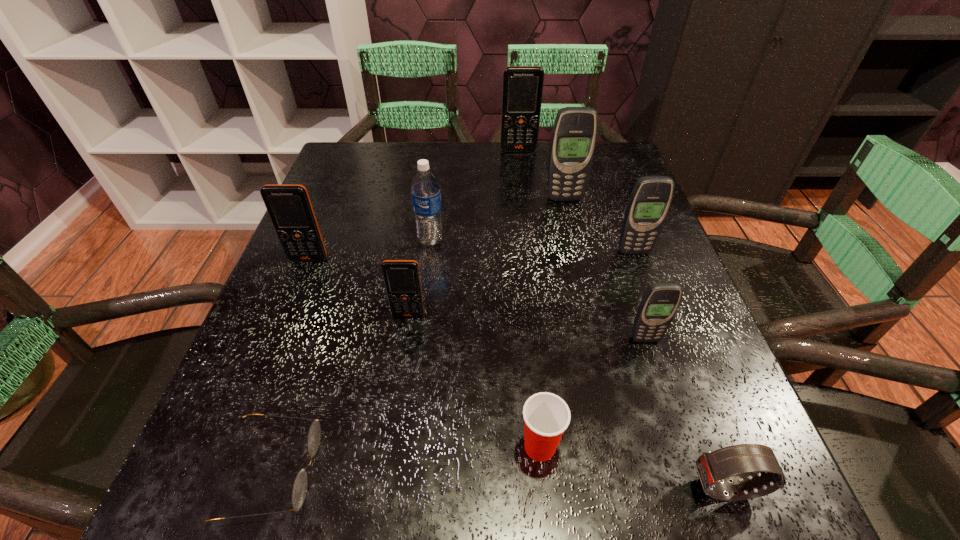
The width and height of the screenshot is (960, 540). Find the location of `free space located 0.080m on the screen of the second smallest gray cellular telephone`. free space located 0.080m on the screen of the second smallest gray cellular telephone is located at coordinates (645, 282).

This screenshot has height=540, width=960. What are the coordinates of `vacant space positioned 0.080m on the screen of the second farthest orange cellular telephone` in the screenshot? It's located at (296, 292).

Locate an element on the screen. The height and width of the screenshot is (540, 960). vacant space located on the screen of the second orange cellular telephone from left to right is located at coordinates (384, 477).

You are a GUI agent. You are given a task and a screenshot of the screen. Output one action in this format:
    pyautogui.click(x=<x>, y=<y>)
    Task: Click on the vacant region located on the screen of the nearest gray cellular telephone
    The image size is (960, 540).
    Given the screenshot: What is the action you would take?
    pyautogui.click(x=691, y=480)

Identify the location of blank area located 0.070m on the left of the Dixie cup. (469, 447).

Find the location of `free space located 0.080m on the face of the watch`. free space located 0.080m on the face of the watch is located at coordinates (630, 489).

Locate an element on the screen. The height and width of the screenshot is (540, 960). vacant area located on the face of the watch is located at coordinates (x=473, y=489).

At what (x,y) coordinates should I click in order to perform the action: click on vacant region located 0.080m on the face of the watch. Please return your answer as a coordinate pair (x, y). This screenshot has width=960, height=540. Looking at the image, I should click on [x=630, y=489].

Image resolution: width=960 pixels, height=540 pixels. I want to click on vacant region located on the temples of the spectacles, so click(601, 471).

Locate an element on the screen. This screenshot has width=960, height=540. object located in the far edge section of the desktop is located at coordinates (522, 90).